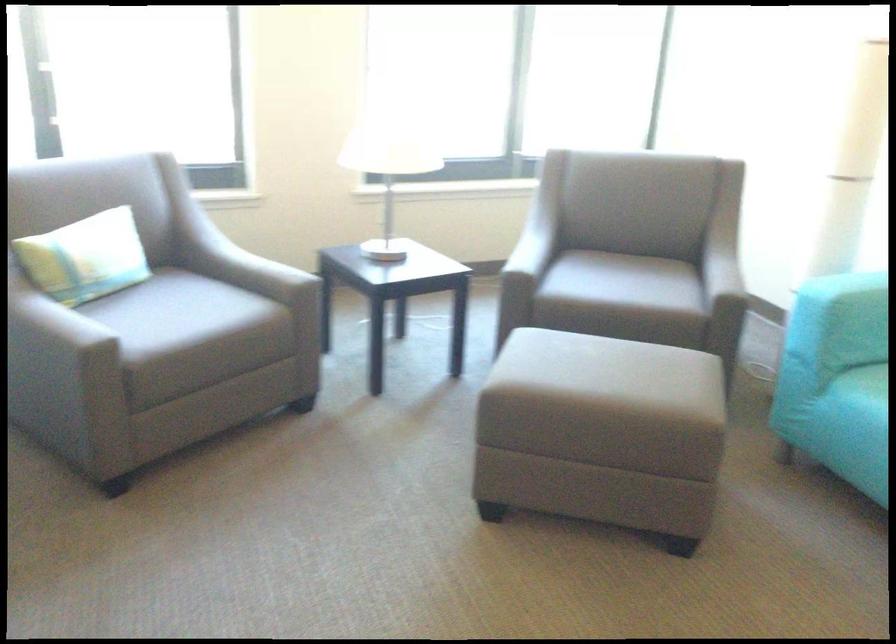
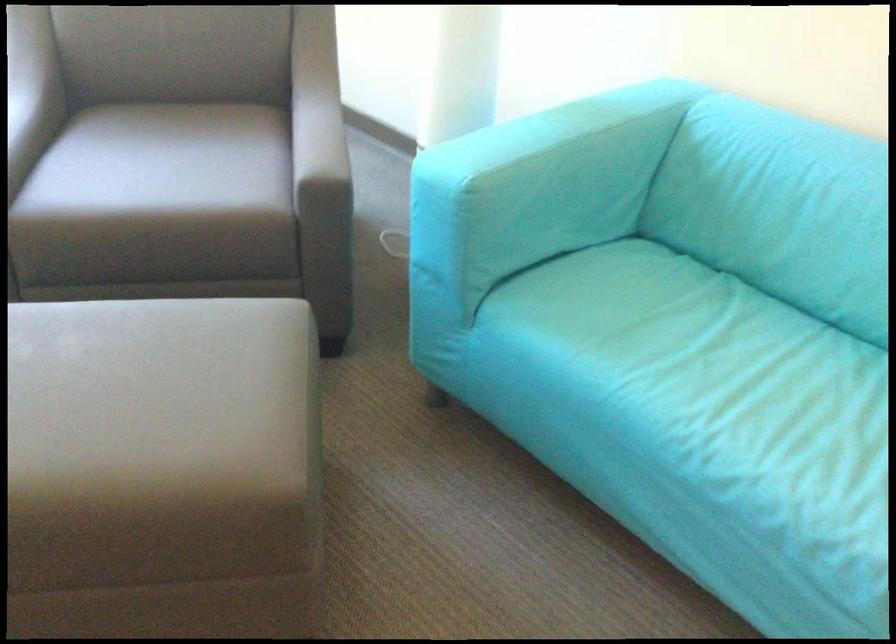
In a continuous first-person perspective shot, in which direction is the camera moving?

The cameraman moved toward right, forward.